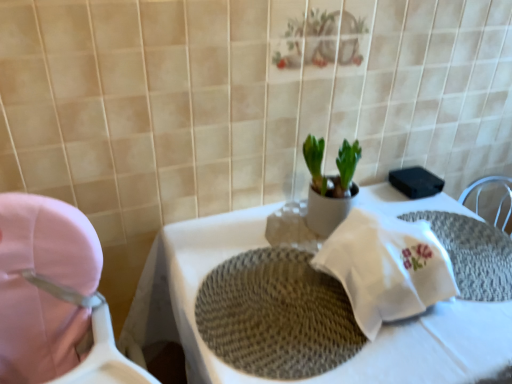
Question: Is white woven placemat at center facing towards white woven placemat at center?

Choices:
 (A) no
 (B) yes

Answer: (A)

Question: Can you confirm if white woven placemat at center is wider than white woven placemat at center?

Choices:
 (A) yes
 (B) no

Answer: (B)

Question: Is the depth of white woven placemat at center less than that of white woven placemat at center?

Choices:
 (A) yes
 (B) no

Answer: (B)

Question: From a real-world perspective, is white woven placemat at center beneath white woven placemat at center?

Choices:
 (A) no
 (B) yes

Answer: (A)

Question: Would you say white woven placemat at center contains white woven placemat at center?

Choices:
 (A) yes
 (B) no

Answer: (B)

Question: Is white woven placemat at center smaller than white woven placemat at center?

Choices:
 (A) yes
 (B) no

Answer: (A)

Question: Is pink fabric baby carriage at left at the right side of white woven placemat at center?

Choices:
 (A) yes
 (B) no

Answer: (B)

Question: Can we say pink fabric baby carriage at left lies outside white woven placemat at center?

Choices:
 (A) yes
 (B) no

Answer: (A)

Question: Would you consider pink fabric baby carriage at left to be distant from white woven placemat at center?

Choices:
 (A) yes
 (B) no

Answer: (B)

Question: Is pink fabric baby carriage at left touching white woven placemat at center?

Choices:
 (A) yes
 (B) no

Answer: (B)

Question: Can you confirm if pink fabric baby carriage at left is positioned to the left of white woven placemat at center?

Choices:
 (A) yes
 (B) no

Answer: (A)

Question: Is pink fabric baby carriage at left taller than white woven placemat at center?

Choices:
 (A) no
 (B) yes

Answer: (B)

Question: Is woven beige placemat at center shorter than white woven placemat at center?

Choices:
 (A) no
 (B) yes

Answer: (B)